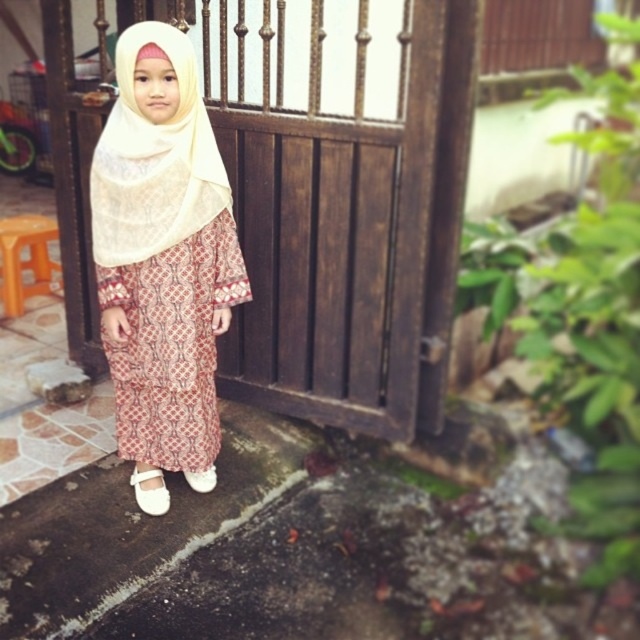
Question: Does wooden gate at center lie in front of white leather shoe at lower center?

Choices:
 (A) no
 (B) yes

Answer: (B)

Question: Can you confirm if white sheer headscarf at center is wider than white leather shoe at lower center?

Choices:
 (A) yes
 (B) no

Answer: (A)

Question: Among these objects, which one is nearest to the camera?

Choices:
 (A) white fabric shoe at lower center
 (B) white sheer headscarf at center
 (C) matte beige hijab at center
 (D) batik-patterned dress at center

Answer: (B)

Question: Considering the real-world distances, which object is farthest from the white sheer headscarf at center?

Choices:
 (A) wooden gate at center
 (B) batik-patterned dress at center
 (C) white leather shoe at lower center
 (D) matte beige hijab at center

Answer: (C)

Question: Considering the real-world distances, which object is closest to the white sheer headscarf at center?

Choices:
 (A) wooden gate at center
 (B) batik-patterned dress at center
 (C) matte beige hijab at center

Answer: (C)

Question: Does white leather shoe at lower center have a lesser width compared to white fabric shoe at lower center?

Choices:
 (A) no
 (B) yes

Answer: (A)